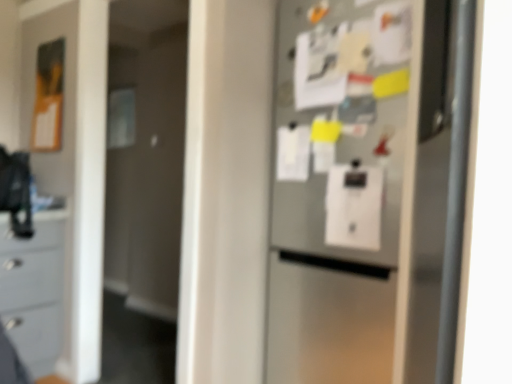
Question: Should I look upward or downward to see satin silver refrigerator at center?

Choices:
 (A) down
 (B) up

Answer: (A)